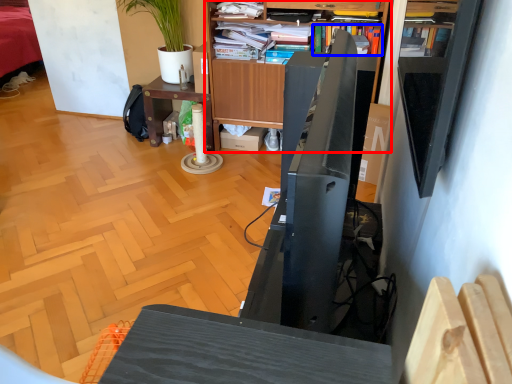
Question: Which object appears closest to the camera in this image, bookcase (highlighted by a red box) or book (highlighted by a blue box)?

Choices:
 (A) bookcase
 (B) book

Answer: (A)